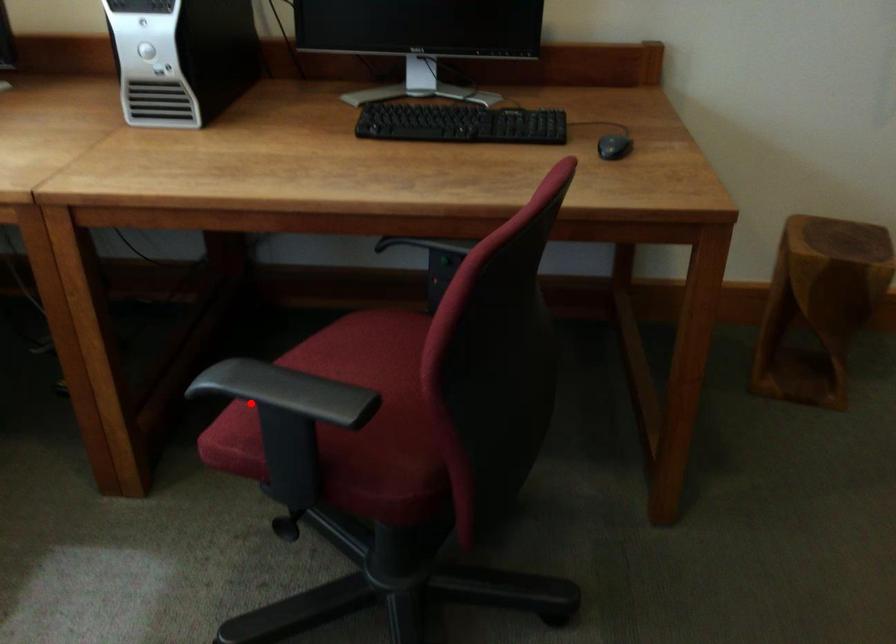
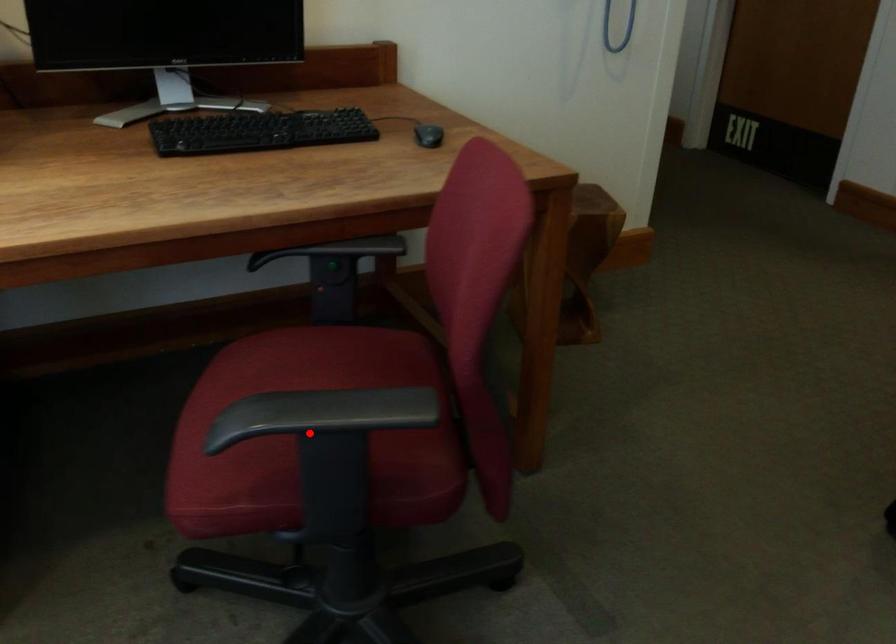
I am providing you with two images of the same scene from different viewpoints. A red point is marked on the first image and another point is marked on the second image. Does the point marked in image1 correspond to the same location as the one in image2?

Yes